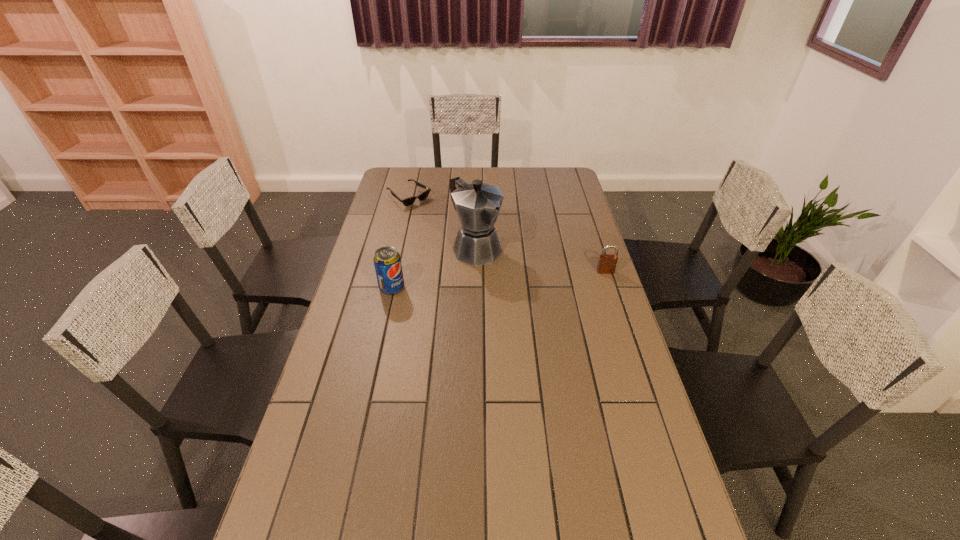
Find the location of a particular element. vacant space on the desktop that is between the soda and the rightmost object and is positioned on the front-facing side of the sunglasses is located at coordinates (520, 278).

Locate an element on the screen. Image resolution: width=960 pixels, height=540 pixels. free spot on the desktop that is between the nearest object and the rightmost object and is positioned at the spout of the tallest object is located at coordinates (516, 278).